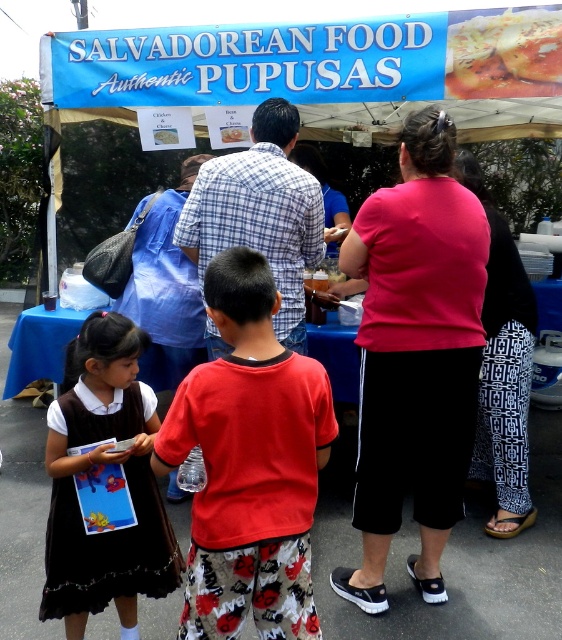
Which is above, pink fabric shirt at center or plaid shirt at center?

plaid shirt at center is above.

Does pink fabric shirt at center have a lesser width compared to plaid shirt at center?

Yes.

This screenshot has width=562, height=640. Identify the location of pink fabric shirt at center. (414, 356).

The image size is (562, 640). Find the location of `pink fabric shirt at center`. pink fabric shirt at center is located at coordinates (414, 356).

Which is in front, point (256, 220) or point (555, 74)?

Positioned in front is point (256, 220).

Who is more forward, (228, 216) or (515, 58)?

Point (228, 216) is more forward.

The height and width of the screenshot is (640, 562). I want to click on plaid shirt at center, so click(260, 212).

Does point (395, 396) lie behind point (260, 624)?

Yes, it is behind point (260, 624).

Identify the location of pink fabric shirt at center. (414, 356).